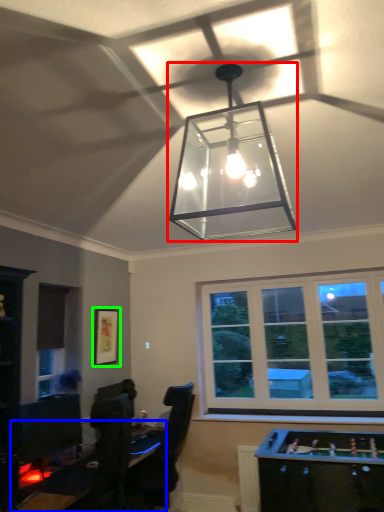
Question: Based on their relative distances, which object is nearer to lamp (highlighted by a red box)? Choose from table (highlighted by a blue box) and picture frame (highlighted by a green box).

Choices:
 (A) table
 (B) picture frame

Answer: (A)